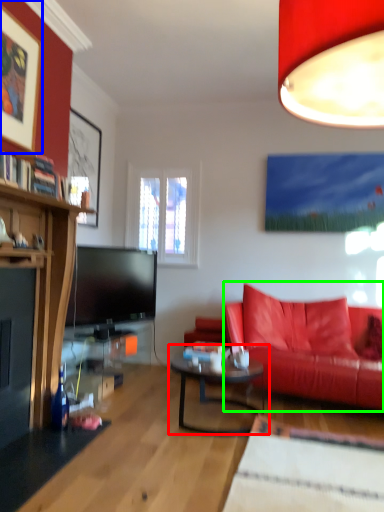
Question: Considering the real-world distances, which object is closest to coffee table (highlighted by a red box)? picture frame (highlighted by a blue box) or studio couch (highlighted by a green box).

Choices:
 (A) picture frame
 (B) studio couch

Answer: (B)